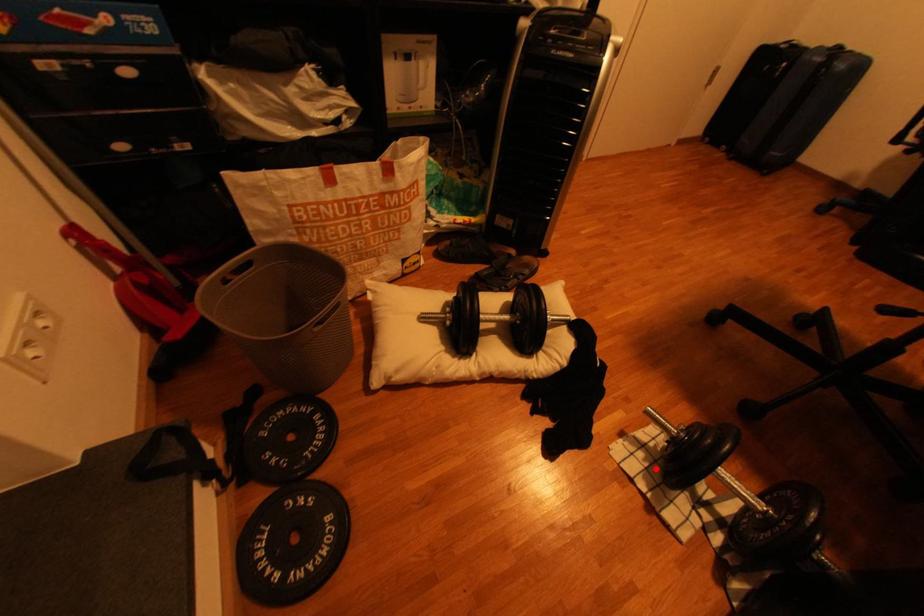
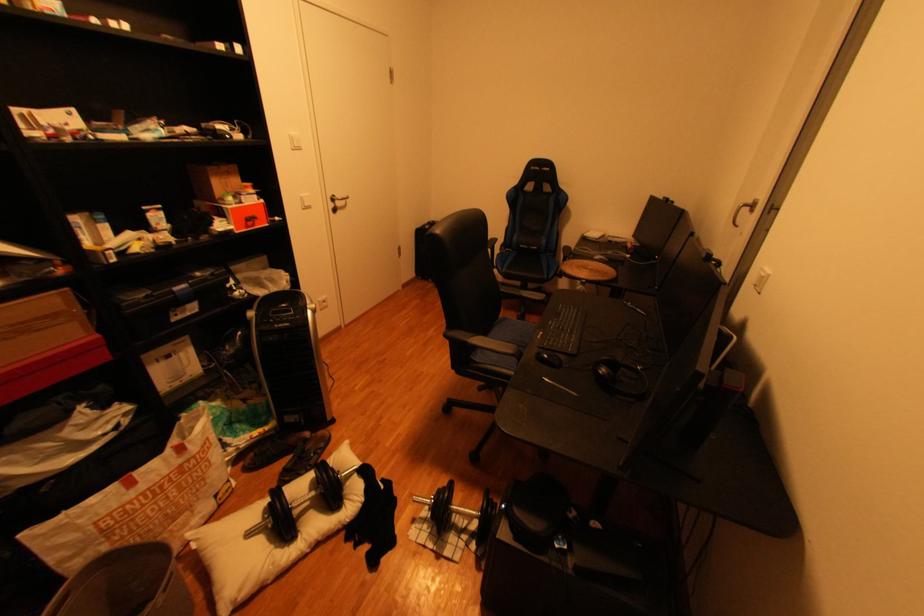
Where in the second image is the point corresponding to the highlighted location from the first image?

(440, 533)